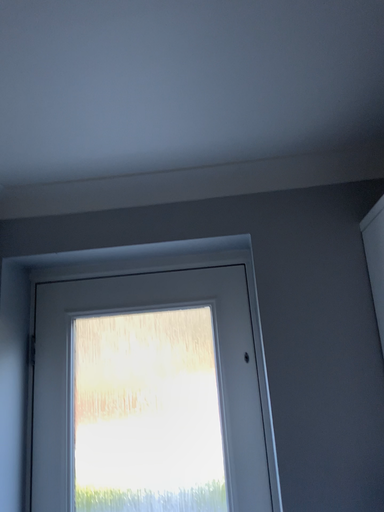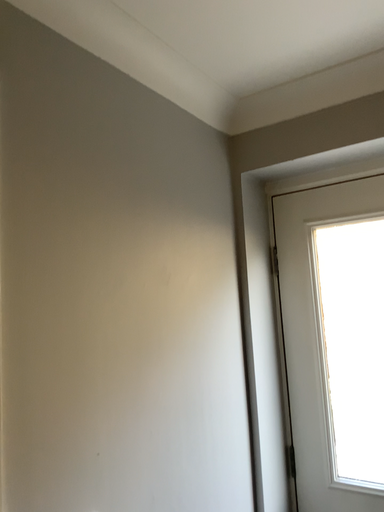
Question: How did the camera likely rotate when shooting the video?

Choices:
 (A) rotated left
 (B) rotated right

Answer: (A)